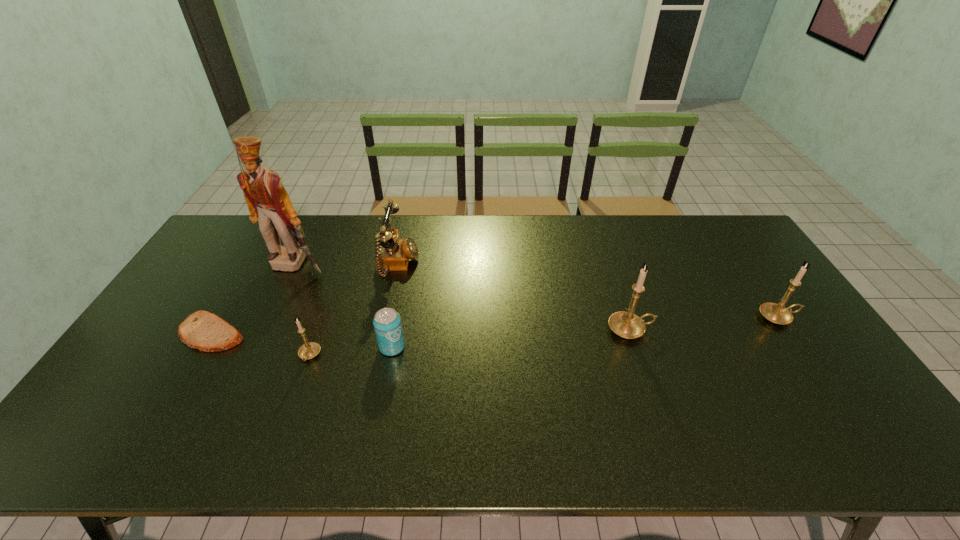
This screenshot has height=540, width=960. I want to click on free point between the shortest object and the second shortest candle holder, so click(x=494, y=325).

Where is `unoccupied position between the telephone and the leftmost candle holder`? Image resolution: width=960 pixels, height=540 pixels. unoccupied position between the telephone and the leftmost candle holder is located at coordinates pos(353,310).

The image size is (960, 540). In order to click on vacant space that's between the pita bread and the sixth object from left to right in this screenshot , I will do `click(421, 331)`.

Where is `empty location between the nutcracker and the second object from right to left`? This screenshot has height=540, width=960. empty location between the nutcracker and the second object from right to left is located at coordinates (464, 297).

Point out which object is positioned as the fifth nearest to the second shortest candle holder. Please provide its 2D coordinates. Your answer should be formatted as a tuple, i.e. [(x, y)], where the tuple contains the x and y coordinates of a point satisfying the conditions above.

[(268, 202)]

Identify which object is the second nearest to the rightmost object. Please provide its 2D coordinates. Your answer should be formatted as a tuple, i.e. [(x, y)], where the tuple contains the x and y coordinates of a point satisfying the conditions above.

[(387, 324)]

Locate which candle holder is the closest to the beer can. Please provide its 2D coordinates. Your answer should be formatted as a tuple, i.e. [(x, y)], where the tuple contains the x and y coordinates of a point satisfying the conditions above.

[(309, 350)]

The image size is (960, 540). What are the coordinates of `candle holder that is the nearest to the beer can` in the screenshot? It's located at (309, 350).

Where is `vacant space that satisfies the following two spatial constraints: 1. on the handle side of the second candle holder from left to right; 2. on the handle side of the shortest candle holder`? The height and width of the screenshot is (540, 960). vacant space that satisfies the following two spatial constraints: 1. on the handle side of the second candle holder from left to right; 2. on the handle side of the shortest candle holder is located at coordinates (639, 355).

Where is `free space that satisfies the following two spatial constraints: 1. on the handle side of the second candle holder from right to left; 2. on the handle side of the third object from left to right`? free space that satisfies the following two spatial constraints: 1. on the handle side of the second candle holder from right to left; 2. on the handle side of the third object from left to right is located at coordinates (639, 355).